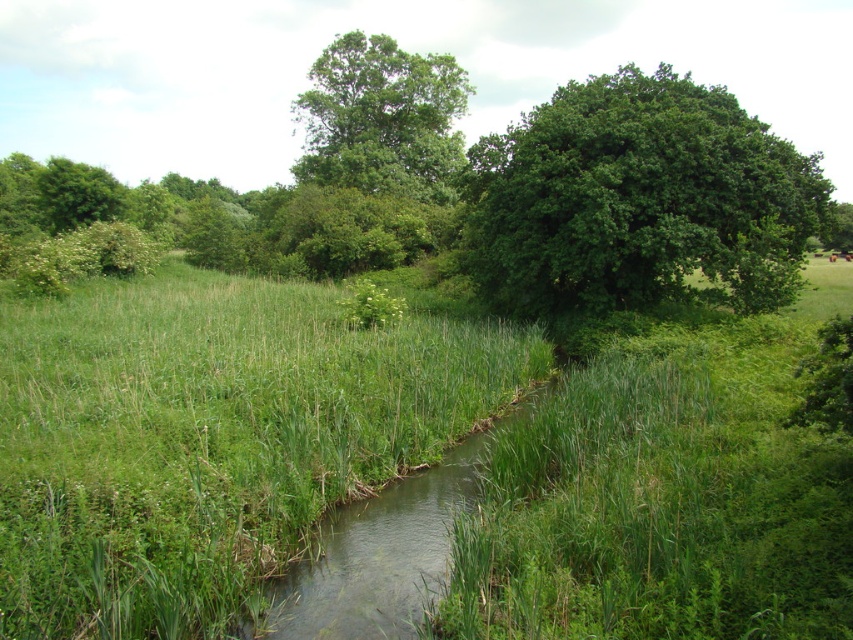
You are standing at the edge of the stream in the scene and want to walk towards the green leafy tree at upper right. Which direction should you move to first reach the green grassy at center before proceeding to the tree?

First, move towards the green grassy at center since it is closer to you than the green leafy tree at upper right. After reaching the green grassy at center, you can then proceed towards the green leafy tree at upper right.

You are standing at the point marked by the coordinates point [209,440] in the image. Looking around, you see the green grassy area at center. What is directly under your feet?

The point [209,440] corresponds to the green grassy area at center, so the ground under your feet is part of the green grassy area at center.

What is the 2D coordinate of the green leafy tree at upper right in the image?

The 2D coordinate of the green leafy tree at upper right is at point (637, 198).